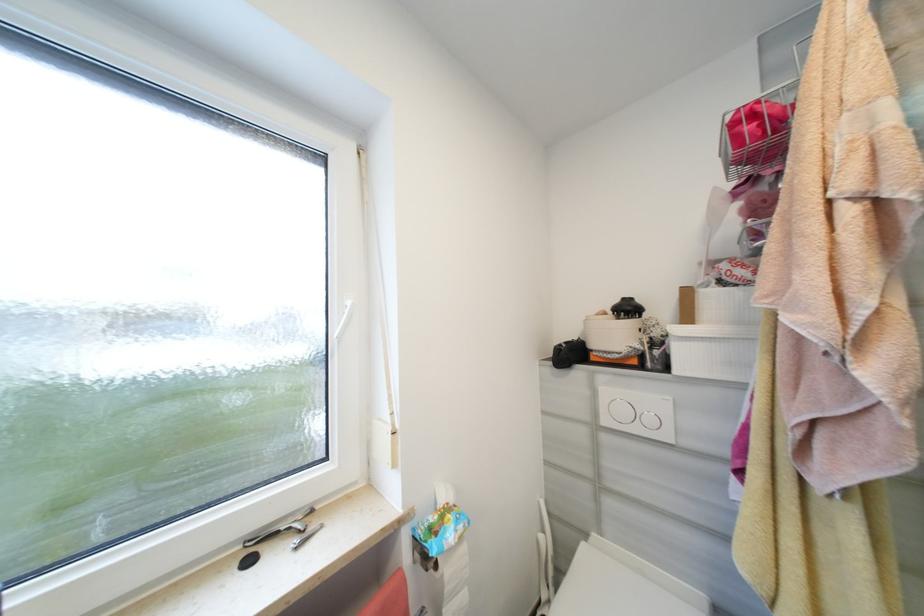
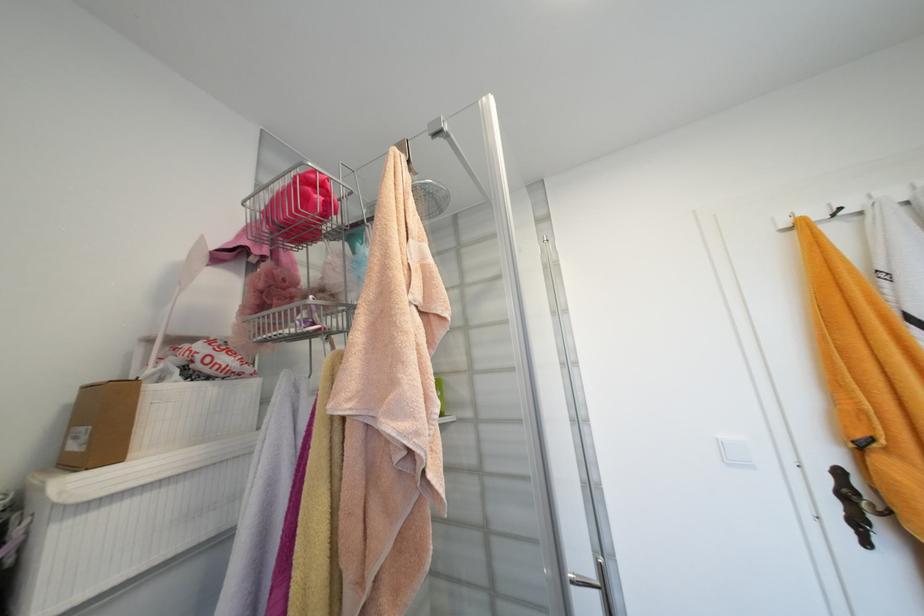
Question: The first image is from the beginning of the video and the second image is from the end. How did the camera likely rotate when shooting the video?

Choices:
 (A) Left
 (B) Right
 (C) Up
 (D) Down

Answer: (B)